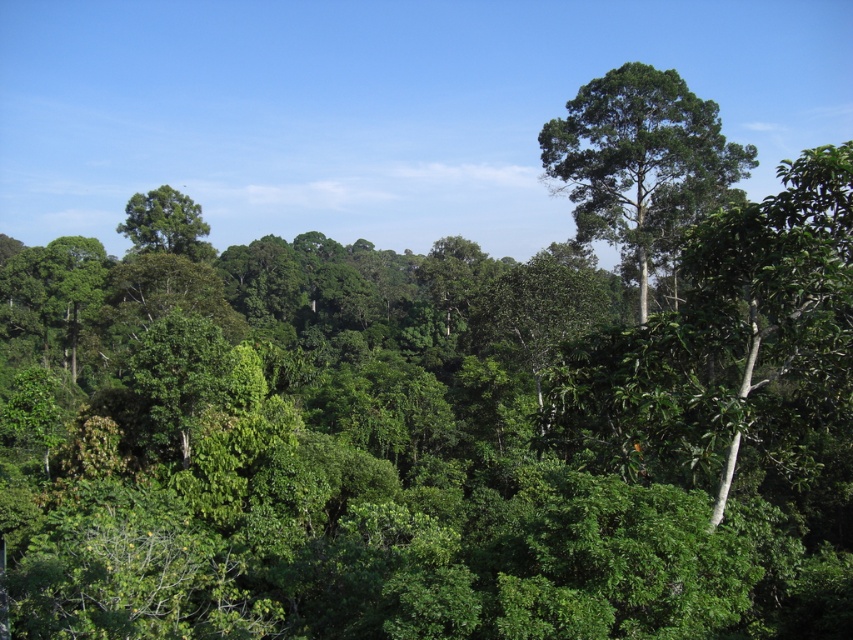
You are a bird flying through the dense tropical forest. You see the green leafy tree at upper right and the green leafy tree at upper left. Which tree is located to the right of the other?

The green leafy tree at upper right is positioned on the right side of green leafy tree at upper left.

Based on the photo, you are a hiker who wants to take a photo of the green leafy tree at upper right. You are currently standing at the point marked as point (x=640, y=163). Is this point a good location to capture the entire tree in your camera frame?

Point (x=640, y=163) corresponds to the green leafy tree at upper right, so standing at this point would place you directly at the tree. To capture the entire tree, you might need to step back or find a different vantage point to ensure the whole tree fits in the frame.

You are a bird flying over the dense tropical forest shown in the image. You need to land on the tallest tree. Which tree should you choose between the green leafy tree at upper right and the green leafy tree at upper left?

The green leafy tree at upper right is larger in size than the green leafy tree at upper left, so you should choose the green leafy tree at upper right to land on as it is taller.